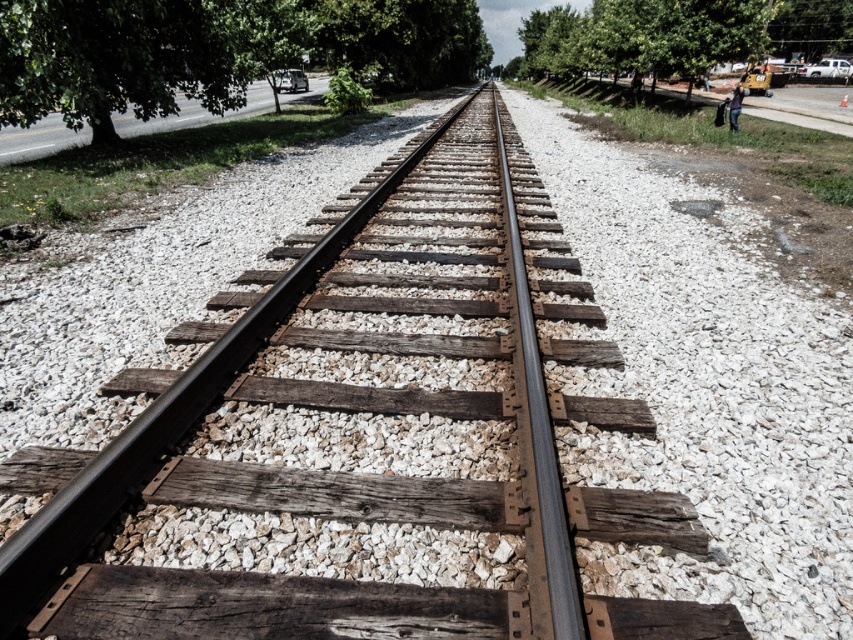
Is the position of green leafy tree at upper left more distant than that of green leafy tree at upper right?

No, it is not.

Which is in front, point (170, 112) or point (712, 1)?

Positioned in front is point (170, 112).

I want to click on green leafy tree at upper left, so click(x=115, y=60).